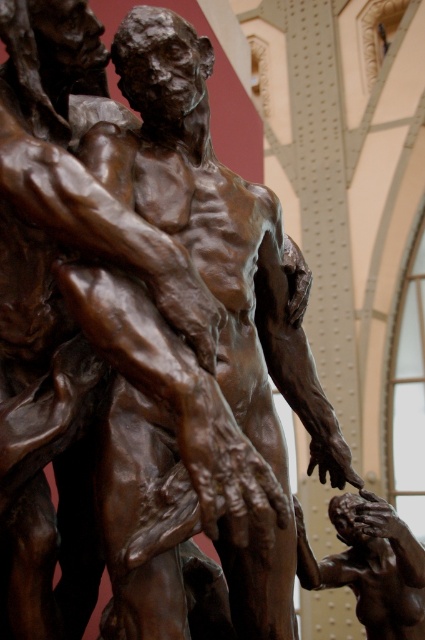
Question: Among these objects, which one is nearest to the camera?

Choices:
 (A) bronze statue at center
 (B) bronze figure at center

Answer: (A)

Question: Can you confirm if bronze statue at center is positioned below bronze figure at center?

Choices:
 (A) no
 (B) yes

Answer: (A)

Question: Can you confirm if bronze statue at center is positioned below bronze figure at center?

Choices:
 (A) no
 (B) yes

Answer: (A)

Question: Which point appears closest to the camera in this image?

Choices:
 (A) (408, 573)
 (B) (231, 282)

Answer: (B)

Question: From the image, what is the correct spatial relationship of bronze statue at center in relation to bronze figure at center?

Choices:
 (A) below
 (B) above

Answer: (B)

Question: Which point appears farthest from the camera in this image?

Choices:
 (A) (345, 566)
 (B) (149, 541)

Answer: (A)